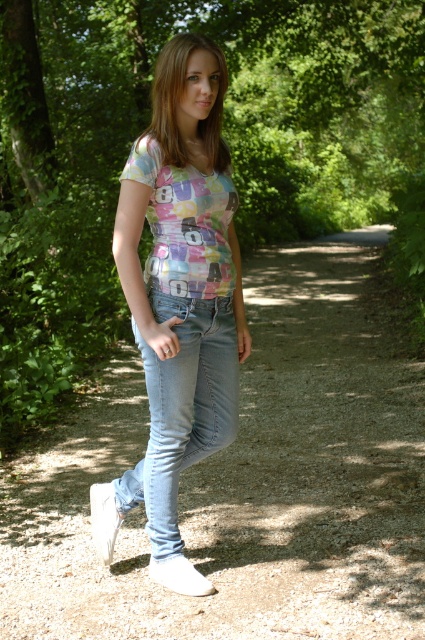
You are a delivery robot with a 36 inch wide package. You need to move along the dirt path at center while avoiding the white suede shoe at lower center. Can you safely navigate the path without hitting the shoe?

The dirt path at center and white suede shoe at lower center are 38.87 inches apart from each other. Since the package is 36 inches wide, there is enough space between the dirt path at center and white suede shoe at lower center to safely navigate without hitting the shoe.